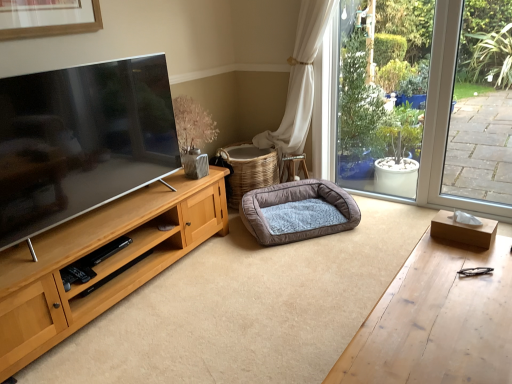
You are a GUI agent. You are given a task and a screenshot of the screen. Output one action in this format:
    pyautogui.click(x=<x>, y=<y>)
    Task: Click on the vacant area on the back side of wooden desk at lower right
    The image size is (512, 384).
    Given the screenshot: What is the action you would take?
    pyautogui.click(x=334, y=289)